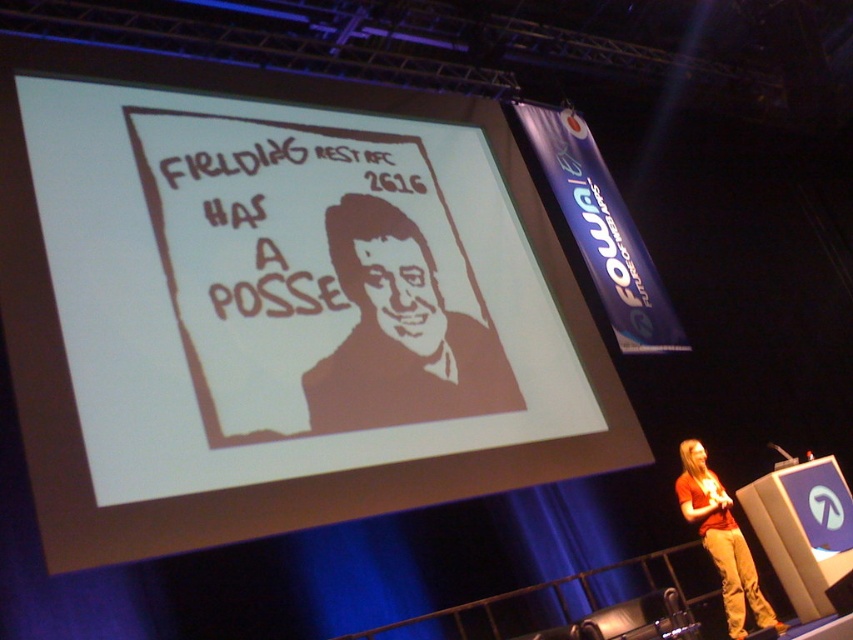
Question: Is white paper at upper center closer to the viewer compared to matte orange shirt at lower right?

Choices:
 (A) no
 (B) yes

Answer: (B)

Question: Which object is the closest to the white paper at upper center?

Choices:
 (A) brown paper portrait at center
 (B) matte orange shirt at lower right

Answer: (A)

Question: Which object appears closest to the camera in this image?

Choices:
 (A) matte orange shirt at lower right
 (B) white paper at upper center
 (C) brown paper portrait at center

Answer: (B)

Question: Can you confirm if white paper at upper center is positioned to the right of brown paper portrait at center?

Choices:
 (A) no
 (B) yes

Answer: (A)

Question: Which object is positioned farthest from the white paper at upper center?

Choices:
 (A) brown paper portrait at center
 (B) matte orange shirt at lower right

Answer: (B)

Question: Observing the image, what is the correct spatial positioning of white paper at upper center in reference to brown paper portrait at center?

Choices:
 (A) above
 (B) below

Answer: (A)